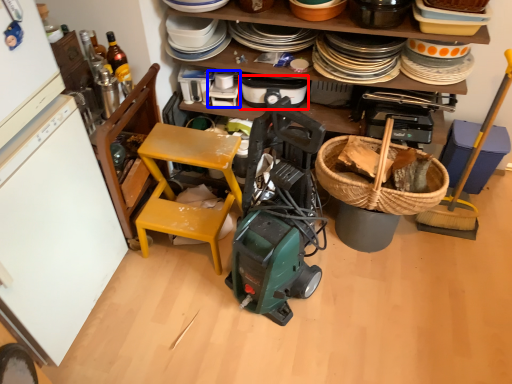
Question: Which object is closer to the camera taking this photo, appliance (highlighted by a red box) or appliance (highlighted by a blue box)?

Choices:
 (A) appliance
 (B) appliance

Answer: (A)